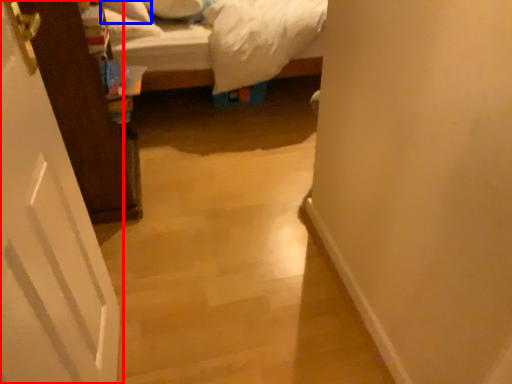
Question: Which of the following is the closest to the observer, door (highlighted by a red box) or pillow (highlighted by a blue box)?

Choices:
 (A) door
 (B) pillow

Answer: (A)